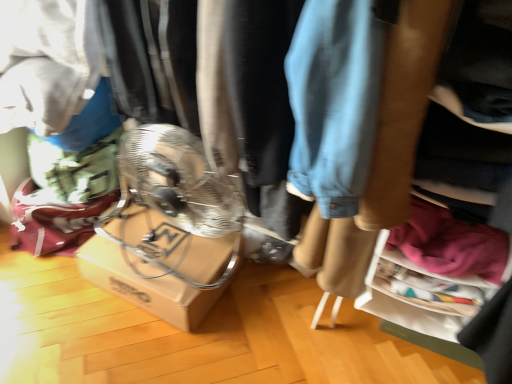
The height and width of the screenshot is (384, 512). I want to click on pink fabric at lower right, so click(451, 243).

This screenshot has height=384, width=512. Describe the element at coordinates (451, 243) in the screenshot. I see `pink fabric at lower right` at that location.

Describe the element at coordinates (160, 265) in the screenshot. I see `brown cardboard box at center` at that location.

You are a GUI agent. You are given a task and a screenshot of the screen. Output one action in this format:
    pyautogui.click(x=<x>, y=<y>)
    Task: Click on the brown cardboard box at center
    
    Given the screenshot: What is the action you would take?
    pyautogui.click(x=160, y=265)

Image resolution: width=512 pixels, height=384 pixels. Find the location of `pink fabric at lower right`. pink fabric at lower right is located at coordinates (451, 243).

Is brown cardboard box at center to the left of pink fabric at lower right from the viewer's perspective?

Yes.

Which is behind, brown cardboard box at center or pink fabric at lower right?

brown cardboard box at center is further from the camera.

Considering the points (223, 282) and (465, 261), which point is in front, point (223, 282) or point (465, 261)?

The point (465, 261) is closer to the camera.

From the image's perspective, would you say brown cardboard box at center is positioned over pink fabric at lower right?

No.

From a real-world perspective, is brown cardboard box at center over pink fabric at lower right?

No, from a real-world perspective, brown cardboard box at center is not over pink fabric at lower right

Is brown cardboard box at center thinner than pink fabric at lower right?

In fact, brown cardboard box at center might be wider than pink fabric at lower right.

Is brown cardboard box at center shorter than pink fabric at lower right?

Yes, brown cardboard box at center is shorter than pink fabric at lower right.

Considering the sizes of objects brown cardboard box at center and pink fabric at lower right in the image provided, who is smaller, brown cardboard box at center or pink fabric at lower right?

pink fabric at lower right.

Is brown cardboard box at center inside or outside of pink fabric at lower right?

brown cardboard box at center is outside pink fabric at lower right.

Is brown cardboard box at center next to pink fabric at lower right and touching it?

No, brown cardboard box at center is not with pink fabric at lower right.

Based on the photo, is brown cardboard box at center turned away from pink fabric at lower right?

No, pink fabric at lower right is not at the back of brown cardboard box at center.

How different are the orientations of brown cardboard box at center and pink fabric at lower right in degrees?

The angle between the facing direction of brown cardboard box at center and the facing direction of pink fabric at lower right is 3.18 degrees.

What are the coordinates of `cardboard box that appears on the left of pink fabric at lower right` in the screenshot? It's located at (160, 265).

Based on the photo, would you say pink fabric at lower right is to the left or to the right of brown cardboard box at center in the picture?

In the image, pink fabric at lower right appears on the right side of brown cardboard box at center.

Which is in front, pink fabric at lower right or brown cardboard box at center?

pink fabric at lower right.

Is point (471, 246) farther from camera compared to point (176, 235)?

No, (471, 246) is in front of (176, 235).

From the image's perspective, which one is positioned higher, pink fabric at lower right or brown cardboard box at center?

pink fabric at lower right is shown above in the image.

Based on the photo, from a real-world perspective, does pink fabric at lower right stand above brown cardboard box at center?

Correct, in the physical world, pink fabric at lower right is higher than brown cardboard box at center.

Considering the sizes of pink fabric at lower right and brown cardboard box at center in the image, is pink fabric at lower right wider or thinner than brown cardboard box at center?

Clearly, pink fabric at lower right has less width compared to brown cardboard box at center.

Does pink fabric at lower right have a lesser height compared to brown cardboard box at center?

No.

Between pink fabric at lower right and brown cardboard box at center, which one has larger size?

brown cardboard box at center is bigger.

Would you say pink fabric at lower right is outside brown cardboard box at center?

Yes, pink fabric at lower right is not within brown cardboard box at center.

Are pink fabric at lower right and brown cardboard box at center beside each other?

No.

Is pink fabric at lower right positioned with its back to brown cardboard box at center?

pink fabric at lower right does not have its back to brown cardboard box at center.

How different are the orientations of pink fabric at lower right and brown cardboard box at center in degrees?

The angle between the facing direction of pink fabric at lower right and the facing direction of brown cardboard box at center is 3.18 degrees.

In order to click on cardboard box behind the pink fabric at lower right in this screenshot , I will do `click(160, 265)`.

Find the location of `cardboard box below the pink fabric at lower right (from the image's perspective)`. cardboard box below the pink fabric at lower right (from the image's perspective) is located at coordinates (160, 265).

This screenshot has height=384, width=512. Find the location of `clothing on the right of brown cardboard box at center`. clothing on the right of brown cardboard box at center is located at coordinates (451, 243).